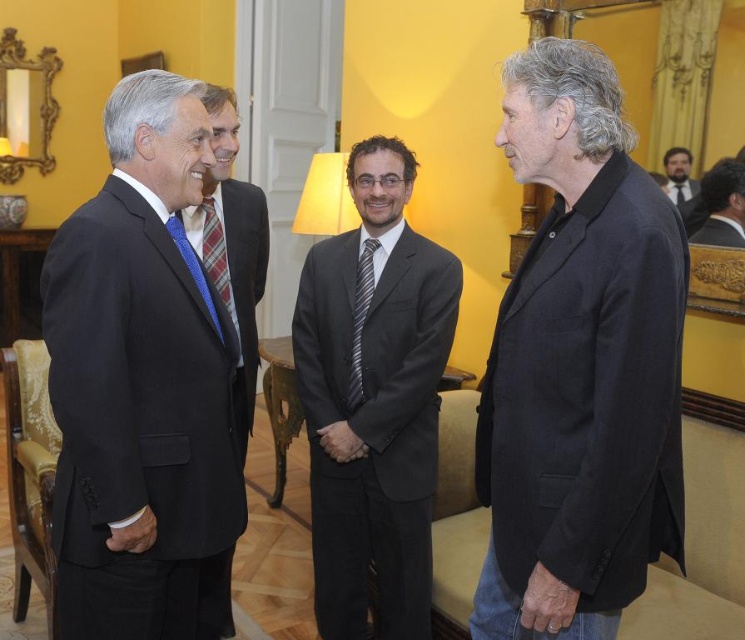
Question: Can you confirm if striped fabric tie at center is smaller than black silk tie at center?

Choices:
 (A) yes
 (B) no

Answer: (B)

Question: Which object is farther from the camera taking this photo?

Choices:
 (A) plaid fabric tie at center
 (B) dark gray suit at center
 (C) black matte suit at right
 (D) black silk suit at upper right

Answer: (C)

Question: Is black silk suit at upper right wider than striped fabric tie at center?

Choices:
 (A) yes
 (B) no

Answer: (A)

Question: Can you confirm if matte black suit at left is wider than dark gray suit at center?

Choices:
 (A) no
 (B) yes

Answer: (A)

Question: Which point is farther to the camera?

Choices:
 (A) (732, 227)
 (B) (215, 246)

Answer: (B)

Question: Which point is farther from the camera taking this photo?

Choices:
 (A) (431, 428)
 (B) (603, 484)
 (C) (226, 465)
 (D) (226, 266)

Answer: (D)